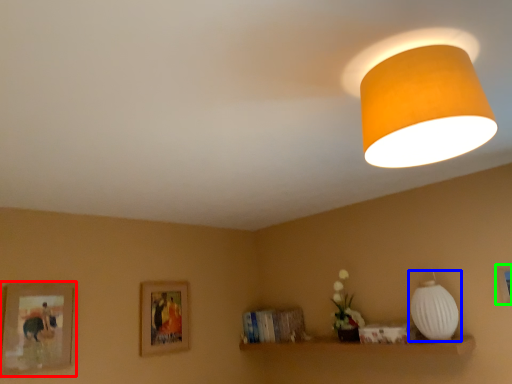
Question: Based on their relative distances, which object is farther from picture frame (highlighted by a red box)? Choose from lamp (highlighted by a blue box) and picture frame (highlighted by a green box).

Choices:
 (A) lamp
 (B) picture frame

Answer: (B)